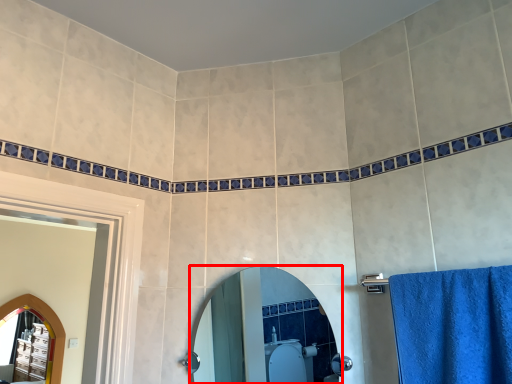
Question: From the image's perspective, where is mirror (annotated by the red box) located in relation to mirror in the image?

Choices:
 (A) above
 (B) below

Answer: (A)